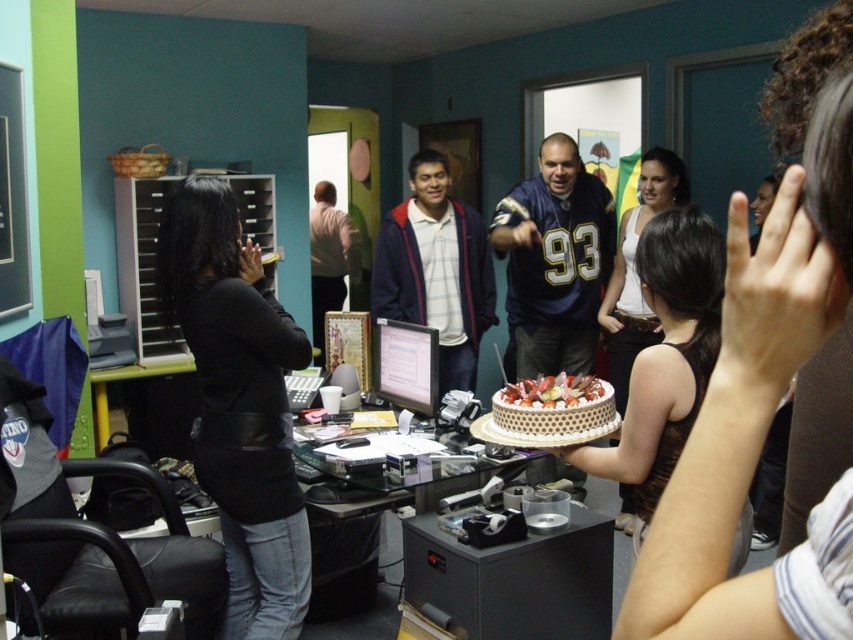
Can you confirm if matte blue jacket at center is positioned above light brown leather jacket at center?

No, matte blue jacket at center is not above light brown leather jacket at center.

Measure the distance between matte blue jacket at center and camera.

3.54 meters

Identify the location of matte blue jacket at center. (436, 269).

Is blue jersey at center thinner than white textured cake at center?

In fact, blue jersey at center might be wider than white textured cake at center.

Image resolution: width=853 pixels, height=640 pixels. What do you see at coordinates (554, 260) in the screenshot? I see `blue jersey at center` at bounding box center [554, 260].

Does point (561, 188) lie in front of point (535, 428)?

No.

I want to click on blue jersey at center, so click(554, 260).

Who is taller, matte blue jacket at center or white textured cake at center?

matte blue jacket at center is taller.

Can you confirm if matte blue jacket at center is thinner than white textured cake at center?

Incorrect, matte blue jacket at center's width is not less than white textured cake at center's.

Looking at this image, measure the distance between point (489, 273) and camera.

A distance of 3.90 meters exists between point (489, 273) and camera.

Locate an element on the screen. Image resolution: width=853 pixels, height=640 pixels. matte blue jacket at center is located at coordinates (436, 269).